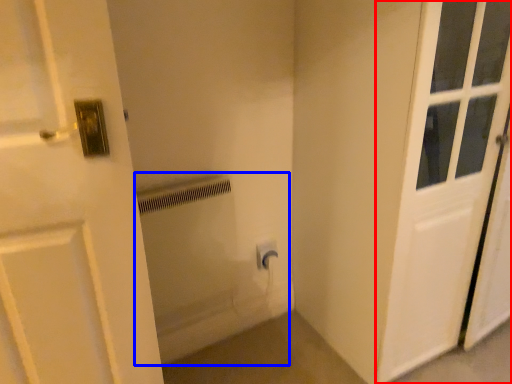
Question: Which object appears closest to the camera in this image, door (highlighted by a red box) or bath (highlighted by a blue box)?

Choices:
 (A) door
 (B) bath

Answer: (A)